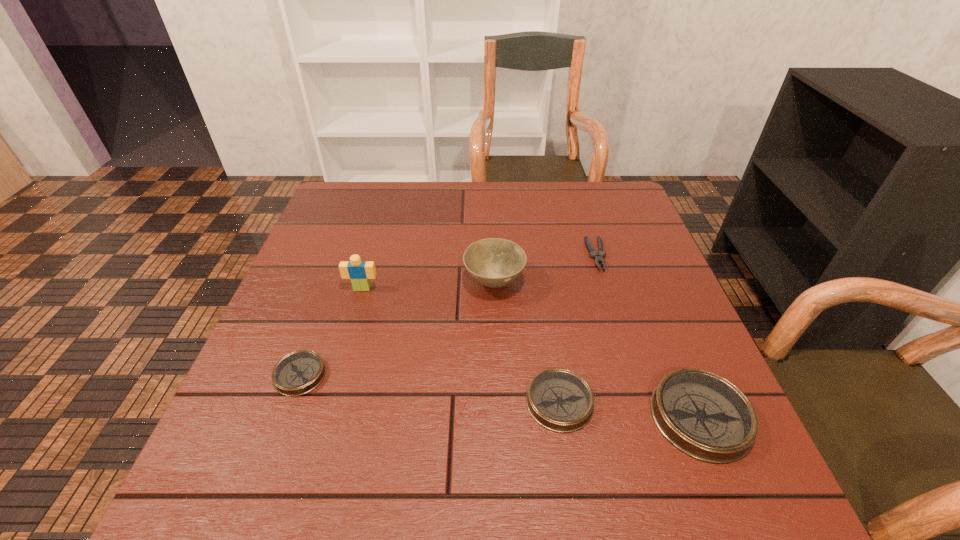
Identify the location of vacant position located 0.370m on the left of the third shortest object. (327, 402).

The width and height of the screenshot is (960, 540). I want to click on vacant space located on the left of the rightmost compass, so click(x=454, y=417).

I want to click on free location located 0.270m at the gripping part of the shortest object, so click(x=629, y=361).

Identify the location of free location located on the back of the bowl. The width and height of the screenshot is (960, 540). (492, 202).

You are a GUI agent. You are given a task and a screenshot of the screen. Output one action in this format:
    pyautogui.click(x=<x>, y=<y>)
    Task: Click on the free region located on the face of the tallest object
    
    Given the screenshot: What is the action you would take?
    pyautogui.click(x=351, y=327)

Identify the location of compass present at the left edge. (297, 373).

At what (x,y) coordinates should I click in order to perform the action: click on Lego that is at the left edge. Please return your answer as a coordinate pair (x, y). Looking at the image, I should click on (359, 272).

What are the coordinates of `compass that is at the right edge` in the screenshot? It's located at (703, 415).

The width and height of the screenshot is (960, 540). Identify the location of pliers located at the right edge. (598, 257).

Locate an element on the screen. This screenshot has width=960, height=540. object positioned at the near right corner is located at coordinates (703, 415).